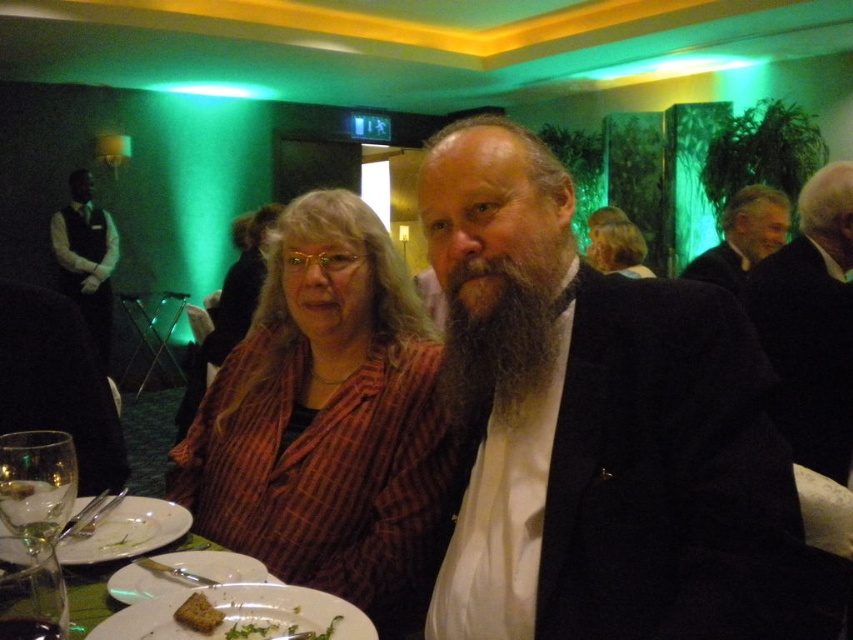
Question: Which object appears closest to the camera in this image?

Choices:
 (A) black shirt at left
 (B) white matte plate at center

Answer: (B)

Question: Can you confirm if white porcelain plates at center is smaller than white porcelain plate at center?

Choices:
 (A) yes
 (B) no

Answer: (B)

Question: Which of the following is the closest to the observer?

Choices:
 (A) black wool suit at center
 (B) white porcelain plate at center
 (C) plaid fabric shirt at center
 (D) crusty bread at lower center

Answer: (B)

Question: Considering the real-world distances, which object is closest to the gray wool sweater at upper right?

Choices:
 (A) white porcelain plates at center
 (B) white porcelain plate at center
 (C) black wool suit at center

Answer: (C)

Question: Where is black shirt at left located in relation to white porcelain plate at center in the image?

Choices:
 (A) left
 (B) right

Answer: (A)

Question: Can you confirm if plaid fabric shirt at center is positioned below gray wool sweater at upper right?

Choices:
 (A) no
 (B) yes

Answer: (B)